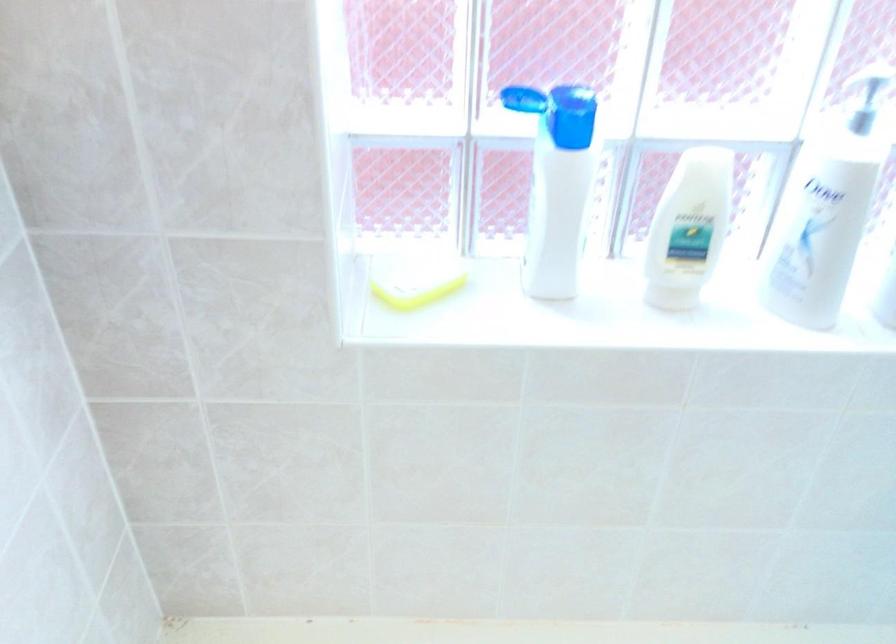
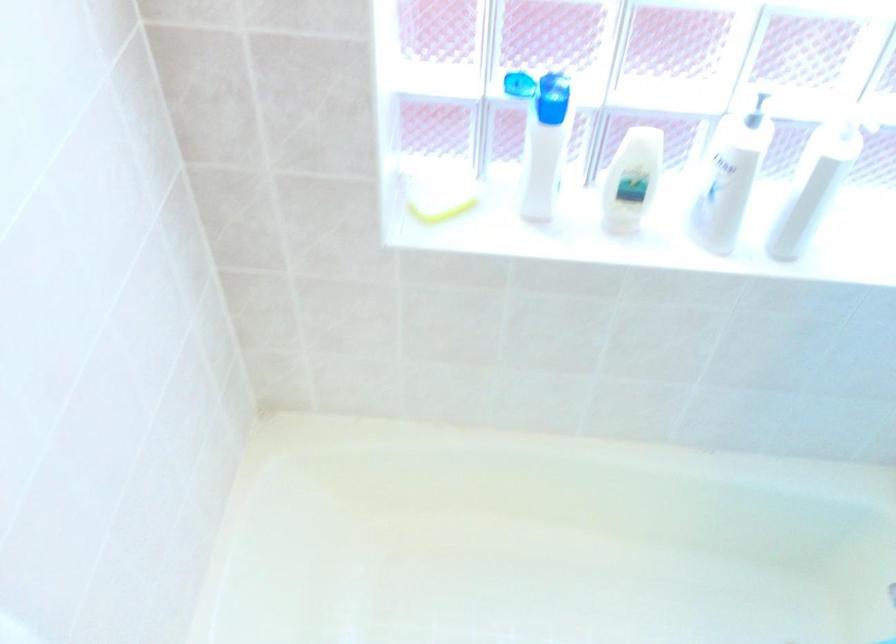
Find the pixel in the second image that matches (822,263) in the first image.

(721, 211)